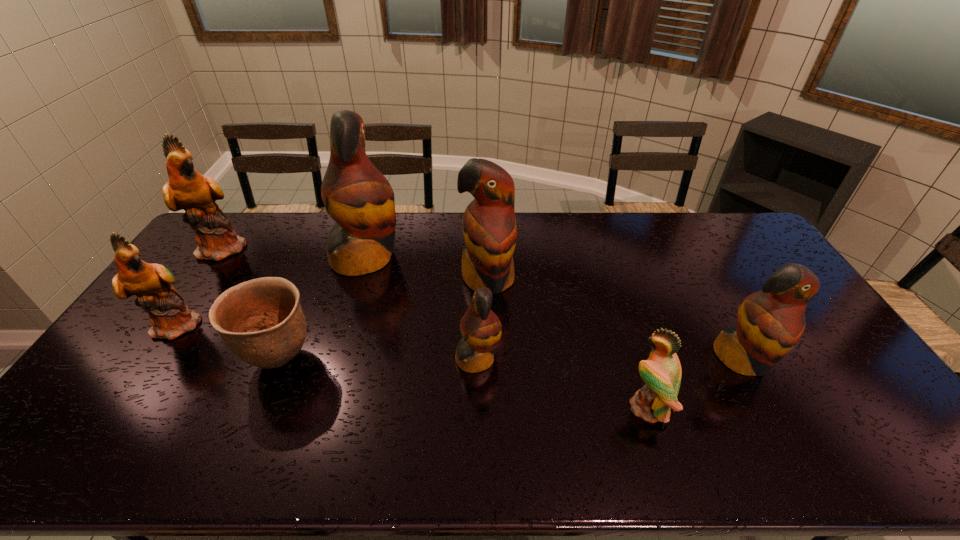
Identify the location of pottery. pos(239,314).

Where is `vacant space located 0.190m on the face of the tallest object`? The image size is (960, 540). vacant space located 0.190m on the face of the tallest object is located at coordinates (456, 258).

Where is `free space located on the front-facing side of the farthest green parrot`? This screenshot has width=960, height=540. free space located on the front-facing side of the farthest green parrot is located at coordinates (296, 247).

What are the coordinates of `vacant point located on the face of the second biggest red parrot` in the screenshot? It's located at click(491, 415).

Where is `vacant region located on the front-facing side of the second biggest green parrot`? The image size is (960, 540). vacant region located on the front-facing side of the second biggest green parrot is located at coordinates (286, 323).

Locate an element on the screen. free space located 0.200m on the face of the rightmost object is located at coordinates (796, 458).

This screenshot has height=540, width=960. Find the location of `free region located on the front-facing side of the second parrot from right to left`. free region located on the front-facing side of the second parrot from right to left is located at coordinates (528, 408).

Identify the location of vacant space situated on the front-facing side of the second parrot from right to left. (524, 408).

The width and height of the screenshot is (960, 540). I want to click on vacant point located on the front-facing side of the second parrot from right to left, so click(567, 408).

Find the location of `free location located on the face of the smallest red parrot`. free location located on the face of the smallest red parrot is located at coordinates (605, 359).